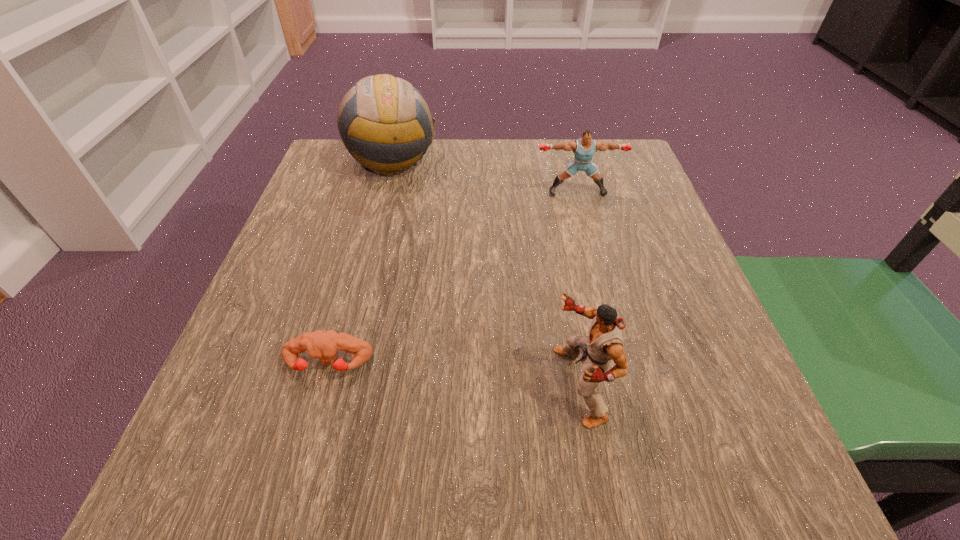
The image size is (960, 540). Find the location of `volleyball`. volleyball is located at coordinates (384, 122).

Find the location of `the tallest puncher`. the tallest puncher is located at coordinates (605, 342).

You are a GUI agent. You are given a task and a screenshot of the screen. Output one action in this format:
    pyautogui.click(x=<x>, y=<y>)
    Task: Click on the farthest puncher
    This screenshot has height=540, width=960.
    Given the screenshot: What is the action you would take?
    pyautogui.click(x=584, y=148)

Locate an element on the screen. the third tallest object is located at coordinates (584, 148).

Image resolution: width=960 pixels, height=540 pixels. In order to click on the leftmost puncher in this screenshot , I will do (x=319, y=344).

The width and height of the screenshot is (960, 540). Identify the location of the shortest puncher. (319, 344).

This screenshot has height=540, width=960. Identify the location of vacant position located 0.230m on the right of the volleyball. (532, 161).

Where is `vacant space located 0.380m on the front-facing side of the tallest puncher`? The width and height of the screenshot is (960, 540). vacant space located 0.380m on the front-facing side of the tallest puncher is located at coordinates pos(293,386).

The height and width of the screenshot is (540, 960). I want to click on vacant position located 0.280m on the front-facing side of the tallest puncher, so click(x=361, y=386).

Locate an element on the screen. free space located on the front-facing side of the tallest puncher is located at coordinates (279, 386).